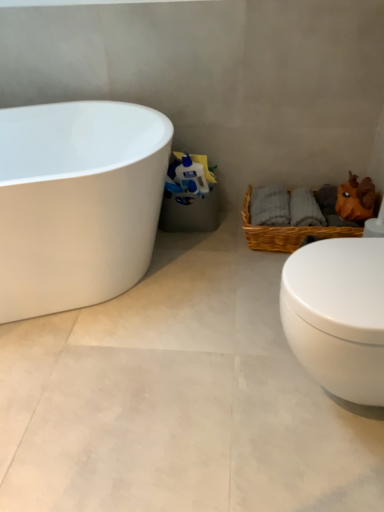
Find the location of a particular element. white glossy toilet at lower right is located at coordinates (338, 315).

Find the location of a particular element. The image size is (384, 512). white glossy toilet paper at center is located at coordinates (189, 177).

Is woven brown picnic basket at lower right taller or shorter than white glossy toilet paper at center?

Considering their sizes, woven brown picnic basket at lower right has more height than white glossy toilet paper at center.

Does woven brown picnic basket at lower right lie behind white glossy toilet paper at center?

No.

Is woven brown picnic basket at lower right not within white glossy toilet paper at center?

Yes, woven brown picnic basket at lower right is located beyond the bounds of white glossy toilet paper at center.

Looking at this image, from the image's perspective, which is above, woven brown picnic basket at lower right or white glossy toilet paper at center?

white glossy toilet paper at center appears higher in the image.

Where is `toilet paper to the left of white glossy toilet at lower right`? The image size is (384, 512). toilet paper to the left of white glossy toilet at lower right is located at coordinates [189, 177].

From the image's perspective, does white glossy toilet at lower right appear higher than white glossy toilet paper at center?

Actually, white glossy toilet at lower right appears below white glossy toilet paper at center in the image.

Is white glossy toilet at lower right turned away from white glossy toilet paper at center?

No.

How far apart are white glossy toilet at lower right and white glossy toilet paper at center?

3.38 feet.

Would you say white glossy toilet paper at center is inside or outside white glossy toilet at lower right?

white glossy toilet paper at center is spatially situated outside white glossy toilet at lower right.

Is white glossy toilet paper at center facing towards white glossy toilet at lower right?

No.

Does white glossy toilet paper at center appear on the right side of white glossy toilet at lower right?

In fact, white glossy toilet paper at center is to the left of white glossy toilet at lower right.

From a real-world perspective, is white glossy toilet paper at center positioned under white glossy toilet at lower right based on gravity?

No, from a real-world perspective, white glossy toilet paper at center is not under white glossy toilet at lower right.

Is white glossy toilet at lower right smaller than white glossy bathtub at left?

Indeed, white glossy toilet at lower right has a smaller size compared to white glossy bathtub at left.

Which object is wider, white glossy toilet at lower right or white glossy bathtub at left?

With larger width is white glossy bathtub at left.

From a real-world perspective, is white glossy toilet at lower right physically above white glossy bathtub at left?

No, from a real-world perspective, white glossy toilet at lower right is not on top of white glossy bathtub at left.

Is white glossy toilet at lower right oriented away from white glossy bathtub at left?

white glossy toilet at lower right does not have its back to white glossy bathtub at left.

Which point is more distant from viewer, (319, 289) or (276, 239)?

Positioned behind is point (276, 239).

From a real-world perspective, which object stands above the other?

white glossy toilet at lower right is physically above.

In the scene shown: From the image's perspective, is white glossy toilet at lower right beneath woven brown picnic basket at lower right?

Indeed, from the image's perspective, white glossy toilet at lower right is shown beneath woven brown picnic basket at lower right.

Considering the sizes of white glossy toilet at lower right and woven brown picnic basket at lower right in the image, is white glossy toilet at lower right bigger or smaller than woven brown picnic basket at lower right?

Considering their sizes, white glossy toilet at lower right takes up more space than woven brown picnic basket at lower right.

The width and height of the screenshot is (384, 512). What are the coordinates of `toilet below the white glossy bathtub at left (from a real-world perspective)` in the screenshot? It's located at (338, 315).

Which object is closer to the camera, white glossy bathtub at left or white glossy toilet at lower right?

white glossy toilet at lower right.

Considering the sizes of objects white glossy bathtub at left and white glossy toilet at lower right in the image provided, who is taller, white glossy bathtub at left or white glossy toilet at lower right?

white glossy bathtub at left.

Which is more to the left, white glossy bathtub at left or white glossy toilet at lower right?

Positioned to the left is white glossy bathtub at left.

In terms of size, does white glossy bathtub at left appear bigger or smaller than woven brown picnic basket at lower right?

In the image, white glossy bathtub at left appears to be larger than woven brown picnic basket at lower right.

Are white glossy bathtub at left and woven brown picnic basket at lower right far apart?

No.

Where is `bathtub above the woven brown picnic basket at lower right (from a real-world perspective)`? bathtub above the woven brown picnic basket at lower right (from a real-world perspective) is located at coordinates (77, 202).

Where is `picnic basket below the white glossy toilet paper at center (from a real-world perspective)`? The height and width of the screenshot is (512, 384). picnic basket below the white glossy toilet paper at center (from a real-world perspective) is located at coordinates (286, 232).

Identify the location of toilet paper above the white glossy toilet at lower right (from the image's perspective). point(189,177).

When comparing their distances from white glossy toilet at lower right, does white glossy bathtub at left or woven brown picnic basket at lower right seem further?

Based on the image, white glossy bathtub at left appears to be further to white glossy toilet at lower right.

From the picture: Which object lies further to the anchor point white glossy bathtub at left, woven brown picnic basket at lower right or white glossy toilet at lower right?

white glossy toilet at lower right is further to white glossy bathtub at left.

From the image, which object appears to be farther from white glossy toilet paper at center, white glossy toilet at lower right or woven brown picnic basket at lower right?

The object further to white glossy toilet paper at center is white glossy toilet at lower right.

Looking at this image, looking at the image, which one is located closer to white glossy toilet paper at center, white glossy bathtub at left or white glossy toilet at lower right?

white glossy bathtub at left is positioned closer to the anchor white glossy toilet paper at center.

Looking at the image, which one is located further to woven brown picnic basket at lower right, white glossy bathtub at left or white glossy toilet at lower right?

Among the two, white glossy bathtub at left is located further to woven brown picnic basket at lower right.

Looking at the image, which one is located closer to white glossy toilet at lower right, white glossy toilet paper at center or woven brown picnic basket at lower right?

woven brown picnic basket at lower right.

Considering their positions, is white glossy toilet at lower right positioned closer to woven brown picnic basket at lower right than white glossy bathtub at left?

Based on the image, white glossy toilet at lower right appears to be nearer to woven brown picnic basket at lower right.

Consider the image. Estimate the real-world distances between objects in this image. Which object is further from white glossy toilet paper at center, white glossy bathtub at left or woven brown picnic basket at lower right?

white glossy bathtub at left is positioned further to the anchor white glossy toilet paper at center.

Find the location of a particular element. The height and width of the screenshot is (512, 384). picnic basket between white glossy toilet at lower right and white glossy toilet paper at center along the z-axis is located at coordinates (286, 232).

At what (x,y) coordinates should I click in order to perform the action: click on bathtub positioned between white glossy toilet at lower right and white glossy toilet paper at center from near to far. Please return your answer as a coordinate pair (x, y). Looking at the image, I should click on (77, 202).

At what (x,y) coordinates should I click in order to perform the action: click on toilet paper between white glossy bathtub at left and woven brown picnic basket at lower right in the horizontal direction. Please return your answer as a coordinate pair (x, y). Looking at the image, I should click on (189, 177).

I want to click on toilet between white glossy bathtub at left and woven brown picnic basket at lower right, so click(338, 315).